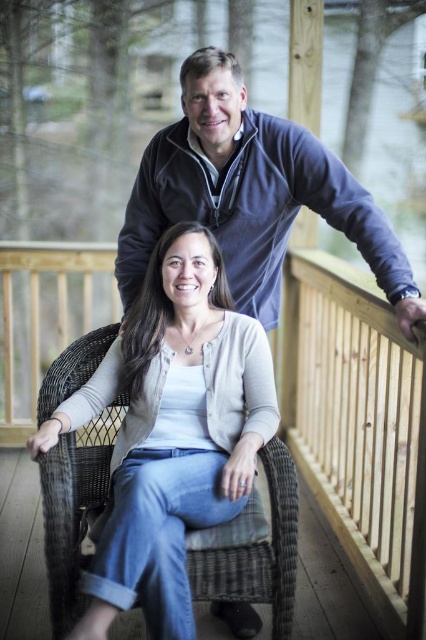
You are a fashion designer analyzing the clothing items in the image. Which clothing item, the matte gray cardigan at center or the blue fleece sweater at upper center, is taller in the image?

The matte gray cardigan at center is taller than the blue fleece sweater at upper center.

You are a photographer trying to capture a clear shot of the matte gray cardigan at center and the light wood railing at upper right. Based on their positions, which object is closer to the camera?

The matte gray cardigan at center is closer to the camera because it is in front of the light wood railing at upper right.